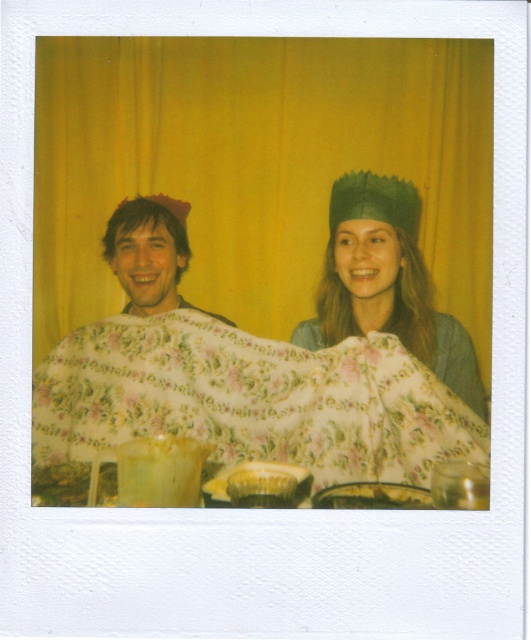
Who is lower down, floral cotton blanket at center or matte floral blanket at left?

floral cotton blanket at center is lower down.

Can you confirm if floral cotton blanket at center is shorter than matte floral blanket at left?

Correct, floral cotton blanket at center is not as tall as matte floral blanket at left.

Between point (92, 380) and point (127, 304), which one is positioned in front?

Point (92, 380)

Locate an element on the screen. Image resolution: width=531 pixels, height=640 pixels. floral cotton blanket at center is located at coordinates (249, 401).

Does point (247, 429) lie in front of point (348, 248)?

Yes, it is in front of point (348, 248).

Who is positioned more to the right, floral cotton blanket at center or floral fabric cape at center?

Positioned to the right is floral fabric cape at center.

The image size is (531, 640). What are the coordinates of `floral cotton blanket at center` in the screenshot? It's located at (249, 401).

Between floral fabric cape at center and matte floral blanket at left, which one is positioned lower?

Positioned lower is floral fabric cape at center.

What do you see at coordinates (387, 284) in the screenshot?
I see `floral fabric cape at center` at bounding box center [387, 284].

Find the location of `floral fabric cape at center`. floral fabric cape at center is located at coordinates point(387,284).

Find the location of a particular element. The image size is (531, 640). floral fabric cape at center is located at coordinates (387, 284).